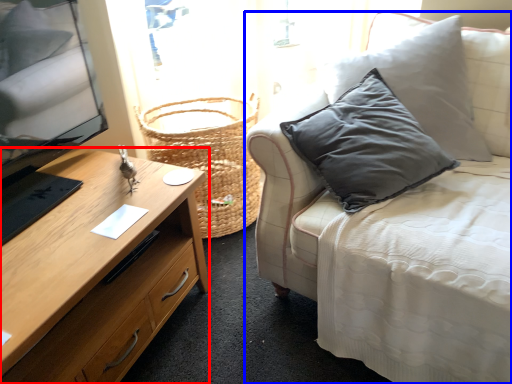
Question: Which object is further to the camera taking this photo, desk (highlighted by a red box) or studio couch (highlighted by a blue box)?

Choices:
 (A) desk
 (B) studio couch

Answer: (A)